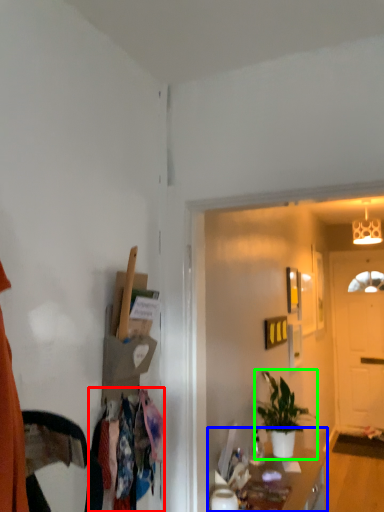
Question: Which is nearer to the clothing (highlighted by a red box)? cabinetry (highlighted by a blue box) or houseplant (highlighted by a green box).

Choices:
 (A) cabinetry
 (B) houseplant

Answer: (A)